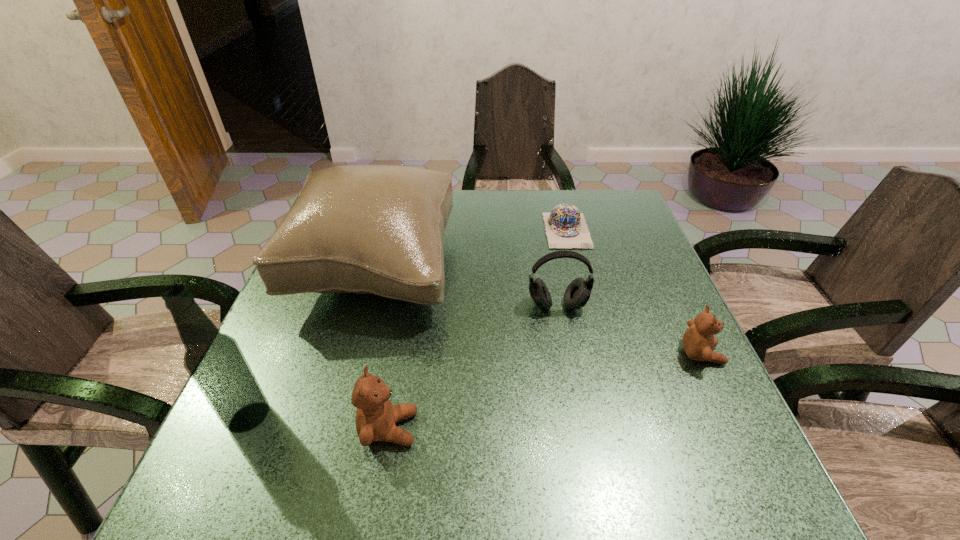
Where is `free space located on the front, side, and top of the shortest object`? This screenshot has height=540, width=960. free space located on the front, side, and top of the shortest object is located at coordinates (601, 362).

Find the location of a particular element. This screenshot has height=540, width=960. free spot located 0.290m on the ear cups of the headset is located at coordinates (582, 434).

Identify the location of free space located 0.390m on the back of the alcohol. The height and width of the screenshot is (540, 960). (315, 268).

This screenshot has width=960, height=540. What are the coordinates of `cushion at the far edge` in the screenshot? It's located at (365, 229).

You are a GUI agent. You are given a task and a screenshot of the screen. Output one action in this format:
    pyautogui.click(x=<x>, y=<y>)
    Task: Click on the cap that is at the far edge
    
    Given the screenshot: What is the action you would take?
    pyautogui.click(x=566, y=227)

In order to click on teddy bear located at the near edge in this screenshot , I will do `click(376, 416)`.

Where is `alcohol situated at the near edge`? The image size is (960, 540). alcohol situated at the near edge is located at coordinates (215, 362).

You are a GUI agent. You are given a task and a screenshot of the screen. Output one action in this format:
    pyautogui.click(x=<x>, y=<y>)
    Task: Click on the cushion at the left edge
    
    Given the screenshot: What is the action you would take?
    pyautogui.click(x=365, y=229)

Locate an element on the screen. alcohol present at the left edge is located at coordinates tap(215, 362).

Locate an element on the screen. The height and width of the screenshot is (540, 960). teddy bear present at the right edge is located at coordinates (698, 341).